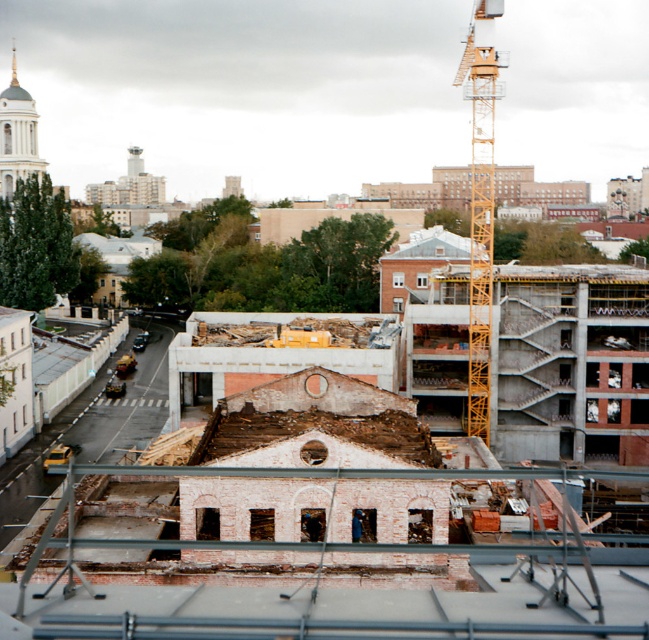
Question: Among these objects, which one is nearest to the camera?

Choices:
 (A) yellow asphalt road at lower left
 (B) yellow metallic crane at upper right

Answer: (A)

Question: Does yellow asphalt road at lower left lie in front of yellow metallic crane at upper right?

Choices:
 (A) no
 (B) yes

Answer: (B)

Question: Is yellow asphalt road at lower left positioned at the back of yellow metallic crane at upper right?

Choices:
 (A) no
 (B) yes

Answer: (A)

Question: Which point is closer to the camera taking this photo?

Choices:
 (A) (491, 156)
 (B) (121, 428)

Answer: (A)

Question: Can you confirm if yellow asphalt road at lower left is positioned below yellow metallic crane at upper right?

Choices:
 (A) yes
 (B) no

Answer: (A)